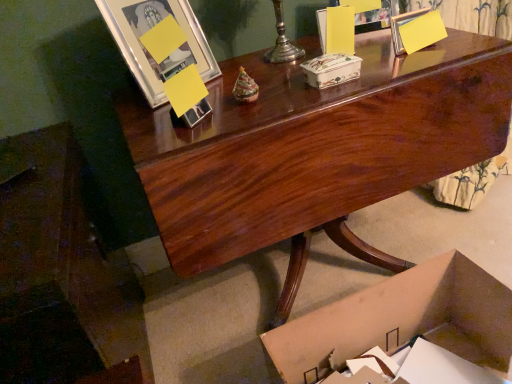
Where is `vacant space underneath glossy wood desk at center (from a real-world perspective)`? This screenshot has width=512, height=384. vacant space underneath glossy wood desk at center (from a real-world perspective) is located at coordinates (309, 273).